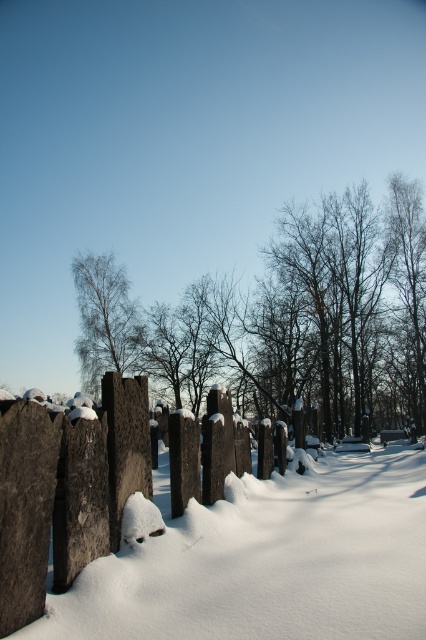
Question: Which of the following is the farthest from the observer?

Choices:
 (A) pos(89,346)
 (B) pos(157,360)

Answer: (A)

Question: Does snow-covered tree at center appear on the left side of dark gray stone fence at center?

Choices:
 (A) yes
 (B) no

Answer: (B)

Question: Where is dark gray stone fence at center located in relation to bare birch tree at center in the image?

Choices:
 (A) left
 (B) right

Answer: (B)

Question: Which of the following is the farthest from the observer?

Choices:
 (A) dark gray stone fence at center
 (B) bare birch tree at center
 (C) snow-covered tree at center

Answer: (B)

Question: Does snow-covered tree at center have a greater width compared to dark gray stone fence at center?

Choices:
 (A) yes
 (B) no

Answer: (A)

Question: Estimate the real-world distances between objects in this image. Which object is farther from the snow-covered tree at center?

Choices:
 (A) dark gray stone fence at center
 (B) bare birch tree at center

Answer: (A)